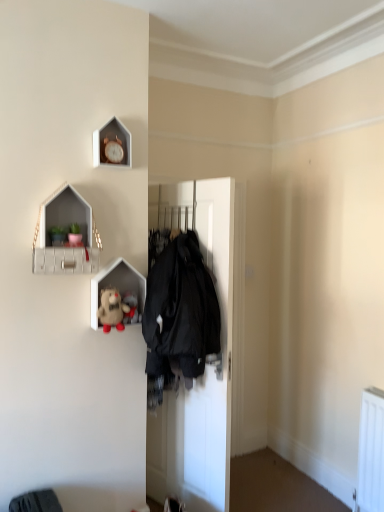
How much space does matte white shelf at upper left, which is the 2th shelf in bottom-to-top order, occupy vertically?

17.09 inches.

What is the approximate width of matte white plush toy at center, positioned as the first shelf in bottom-to-top order?

4.44 inches.

This screenshot has height=512, width=384. Describe the element at coordinates (205, 366) in the screenshot. I see `black matte coat hanger at center` at that location.

In order to face fluffy beige teddy bear at upper left, which is the first toy in front-to-back order, should I rotate leftwards or rightwards?

Turn left approximately 10.540 degrees to face it.

Measure the distance between fluffy fabric stuffed animal at center, which is the 2th toy from front to back, and camera.

fluffy fabric stuffed animal at center, which is the 2th toy from front to back, is 2.12 meters from camera.

Identify the location of matte white shelf at upper left, which appears as the 1th shelf when viewed from the top. Image resolution: width=384 pixels, height=512 pixels. (66, 234).

Between matte white plush toy at center, placed as the second shelf when sorted from top to bottom, and fluffy fabric stuffed animal at center, which appears as the first toy when viewed from the back, which one has more height?

With more height is matte white plush toy at center, placed as the second shelf when sorted from top to bottom.

From the image's perspective, does matte white plush toy at center, placed as the second shelf when sorted from top to bottom, appear higher than fluffy fabric stuffed animal at center, which is the 2th toy from front to back?

Correct, matte white plush toy at center, placed as the second shelf when sorted from top to bottom, appears higher than fluffy fabric stuffed animal at center, which is the 2th toy from front to back, in the image.

Is matte white plush toy at center, positioned as the first shelf in bottom-to-top order, directly adjacent to fluffy fabric stuffed animal at center, which appears as the first toy when viewed from the back?

Yes.

Is matte white plush toy at center, positioned as the first shelf in bottom-to-top order, wider or thinner than fluffy fabric stuffed animal at center, which appears as the first toy when viewed from the back?

Clearly, matte white plush toy at center, positioned as the first shelf in bottom-to-top order, has more width compared to fluffy fabric stuffed animal at center, which appears as the first toy when viewed from the back.

Is wooden clock at upper center further to the viewer compared to fluffy fabric stuffed animal at center, which is the 2th toy from front to back?

No.

Can you tell me how much wooden clock at upper center and fluffy fabric stuffed animal at center, which appears as the first toy when viewed from the back, differ in facing direction?

wooden clock at upper center and fluffy fabric stuffed animal at center, which appears as the first toy when viewed from the back, are facing 0.705 degrees away from each other.

Between wooden clock at upper center and fluffy fabric stuffed animal at center, which appears as the first toy when viewed from the back, which one appears on the right side from the viewer's perspective?

Positioned to the right is fluffy fabric stuffed animal at center, which appears as the first toy when viewed from the back.

In the scene shown: Does wooden clock at upper center have a greater width compared to fluffy fabric stuffed animal at center, which is the 2th toy from front to back?

No, wooden clock at upper center is not wider than fluffy fabric stuffed animal at center, which is the 2th toy from front to back.

How different are the orientations of fluffy beige teddy bear at upper left, which is the first toy in front-to-back order, and matte white shelf at upper left, which appears as the 1th shelf when viewed from the top, in degrees?

0.101 degrees separate the facing orientations of fluffy beige teddy bear at upper left, which is the first toy in front-to-back order, and matte white shelf at upper left, which appears as the 1th shelf when viewed from the top.

Which is in front, point (120, 326) or point (51, 253)?

The point (51, 253) is closer to the camera.

From the image's perspective, relative to matte white shelf at upper left, which appears as the 1th shelf when viewed from the top, is fluffy beige teddy bear at upper left, which is the first toy in front-to-back order, above or below?

Based on their image positions, fluffy beige teddy bear at upper left, which is the first toy in front-to-back order, is located beneath matte white shelf at upper left, which appears as the 1th shelf when viewed from the top.

Is fluffy beige teddy bear at upper left, the 2th toy from the back, facing towards matte white shelf at upper left, which is the 2th shelf in bottom-to-top order?

No, fluffy beige teddy bear at upper left, the 2th toy from the back, is not facing towards matte white shelf at upper left, which is the 2th shelf in bottom-to-top order.

Between fluffy beige teddy bear at upper left, which is the first toy in front-to-back order, and matte white plush toy at center, positioned as the first shelf in bottom-to-top order, which one has larger width?

fluffy beige teddy bear at upper left, which is the first toy in front-to-back order, is wider.

From the image's perspective, is fluffy beige teddy bear at upper left, which is the first toy in front-to-back order, on matte white plush toy at center, placed as the second shelf when sorted from top to bottom?

Actually, fluffy beige teddy bear at upper left, which is the first toy in front-to-back order, appears below matte white plush toy at center, placed as the second shelf when sorted from top to bottom, in the image.

Are fluffy beige teddy bear at upper left, the 2th toy from the back, and matte white plush toy at center, positioned as the first shelf in bottom-to-top order, far apart?

No.

From the image's perspective, between matte white shelf at upper left, which appears as the 1th shelf when viewed from the top, and black matte coat hanger at center, who is located below?

From the image's view, black matte coat hanger at center is below.

Who is smaller, matte white shelf at upper left, which appears as the 1th shelf when viewed from the top, or black matte coat hanger at center?

With smaller size is matte white shelf at upper left, which appears as the 1th shelf when viewed from the top.

Would you say black matte coat hanger at center is part of matte white shelf at upper left, which appears as the 1th shelf when viewed from the top,'s contents?

No, black matte coat hanger at center is located outside of matte white shelf at upper left, which appears as the 1th shelf when viewed from the top.

How different are the orientations of matte white shelf at upper left, which appears as the 1th shelf when viewed from the top, and black matte coat hanger at center in degrees?

The angle between the facing direction of matte white shelf at upper left, which appears as the 1th shelf when viewed from the top, and the facing direction of black matte coat hanger at center is 109 degrees.

Is matte white plush toy at center, positioned as the first shelf in bottom-to-top order, taller or shorter than fluffy beige teddy bear at upper left, which is the first toy in front-to-back order?

Considering their sizes, matte white plush toy at center, positioned as the first shelf in bottom-to-top order, has more height than fluffy beige teddy bear at upper left, which is the first toy in front-to-back order.

Considering the relative sizes of matte white plush toy at center, positioned as the first shelf in bottom-to-top order, and fluffy beige teddy bear at upper left, the 2th toy from the back, in the image provided, is matte white plush toy at center, positioned as the first shelf in bottom-to-top order, smaller than fluffy beige teddy bear at upper left, the 2th toy from the back,?

No, matte white plush toy at center, positioned as the first shelf in bottom-to-top order, is not smaller than fluffy beige teddy bear at upper left, the 2th toy from the back.

In the image, is matte white plush toy at center, placed as the second shelf when sorted from top to bottom, on the left side or the right side of fluffy beige teddy bear at upper left, the 2th toy from the back?

Based on their positions, matte white plush toy at center, placed as the second shelf when sorted from top to bottom, is located to the right of fluffy beige teddy bear at upper left, the 2th toy from the back.

From the image's perspective, which shelf is the 1st one above the fluffy beige teddy bear at upper left, which is the first toy in front-to-back order? Please provide its 2D coordinates.

[(117, 284)]

Does matte white shelf at upper left, which is the 2th shelf in bottom-to-top order, have a greater width compared to matte white plush toy at center, placed as the second shelf when sorted from top to bottom?

Yes, matte white shelf at upper left, which is the 2th shelf in bottom-to-top order, is wider than matte white plush toy at center, placed as the second shelf when sorted from top to bottom.

Consider the image. Could you measure the distance between matte white shelf at upper left, which is the 2th shelf in bottom-to-top order, and matte white plush toy at center, positioned as the first shelf in bottom-to-top order?

matte white shelf at upper left, which is the 2th shelf in bottom-to-top order, and matte white plush toy at center, positioned as the first shelf in bottom-to-top order, are 9.11 inches apart.

Is matte white shelf at upper left, which appears as the 1th shelf when viewed from the top, positioned before matte white plush toy at center, positioned as the first shelf in bottom-to-top order?

Yes, it is.

I want to click on toy located on the right of matte white plush toy at center, placed as the second shelf when sorted from top to bottom, so click(130, 308).

From a real-world perspective, count 2nd toys downward from the wooden clock at upper center and point to it. Please provide its 2D coordinates.

[(130, 308)]

Considering their positions, is matte white shelf at upper left, which appears as the 1th shelf when viewed from the top, positioned further to fluffy fabric stuffed animal at center, which appears as the first toy when viewed from the back, than wooden clock at upper center?

wooden clock at upper center lies further to fluffy fabric stuffed animal at center, which appears as the first toy when viewed from the back, than the other object.

Looking at the image, which one is located further to fluffy beige teddy bear at upper left, the 2th toy from the back, fluffy fabric stuffed animal at center, which appears as the first toy when viewed from the back, or matte white shelf at upper left, which appears as the 1th shelf when viewed from the top?

matte white shelf at upper left, which appears as the 1th shelf when viewed from the top, is positioned further to the anchor fluffy beige teddy bear at upper left, the 2th toy from the back.

When comparing their distances from wooden clock at upper center, does matte white shelf at upper left, which appears as the 1th shelf when viewed from the top, or fluffy fabric stuffed animal at center, which is the 2th toy from front to back, seem further?

fluffy fabric stuffed animal at center, which is the 2th toy from front to back, lies further to wooden clock at upper center than the other object.

Which object lies nearer to the anchor point wooden clock at upper center, matte white shelf at upper left, which is the 2th shelf in bottom-to-top order, or black matte coat hanger at center?

matte white shelf at upper left, which is the 2th shelf in bottom-to-top order, is positioned closer to the anchor wooden clock at upper center.

Based on their spatial positions, is fluffy beige teddy bear at upper left, the 2th toy from the back, or wooden clock at upper center further from matte white shelf at upper left, which appears as the 1th shelf when viewed from the top?

wooden clock at upper center.

When comparing their distances from fluffy fabric stuffed animal at center, which appears as the first toy when viewed from the back, does wooden clock at upper center or matte white plush toy at center, positioned as the first shelf in bottom-to-top order, seem further?

wooden clock at upper center is positioned further to the anchor fluffy fabric stuffed animal at center, which appears as the first toy when viewed from the back.

When comparing their distances from wooden clock at upper center, does fluffy beige teddy bear at upper left, the 2th toy from the back, or black matte coat hanger at center seem closer?

Among the two, fluffy beige teddy bear at upper left, the 2th toy from the back, is located nearer to wooden clock at upper center.

From the image, which object appears to be farther from fluffy beige teddy bear at upper left, which is the first toy in front-to-back order, matte white shelf at upper left, which is the 2th shelf in bottom-to-top order, or wooden clock at upper center?

wooden clock at upper center.

Identify the location of shelf between matte white shelf at upper left, which appears as the 1th shelf when viewed from the top, and fluffy fabric stuffed animal at center, which appears as the first toy when viewed from the back, vertically. The width and height of the screenshot is (384, 512). (117, 284).

Find the location of a particular element. This screenshot has height=512, width=384. toy between wooden clock at upper center and fluffy fabric stuffed animal at center, which is the 2th toy from front to back, vertically is located at coordinates (111, 309).

Locate an element on the screen. shelf between fluffy beige teddy bear at upper left, which is the first toy in front-to-back order, and fluffy fabric stuffed animal at center, which is the 2th toy from front to back, along the z-axis is located at coordinates (117, 284).

The width and height of the screenshot is (384, 512). Identify the location of shelf between matte white shelf at upper left, which is the 2th shelf in bottom-to-top order, and black matte coat hanger at center from top to bottom. (117, 284).